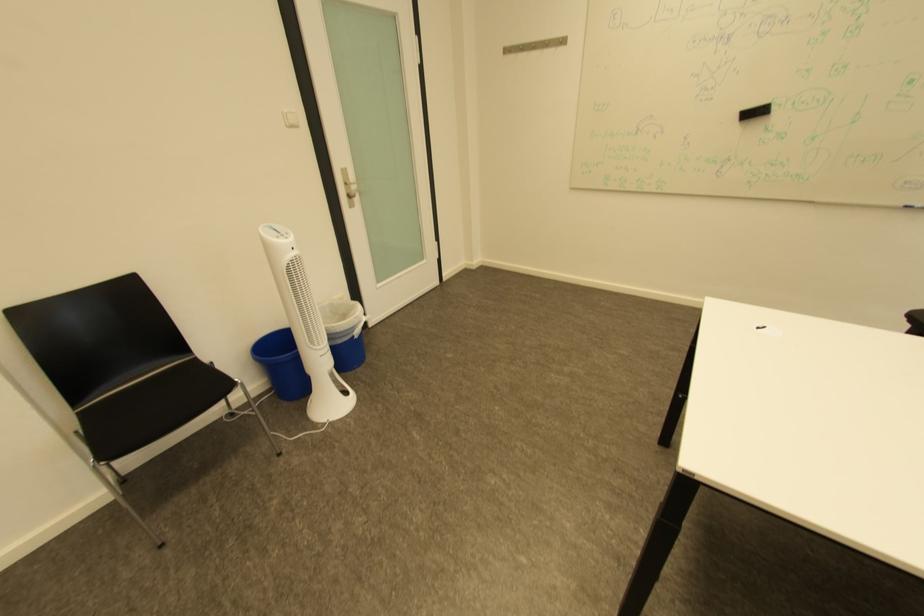
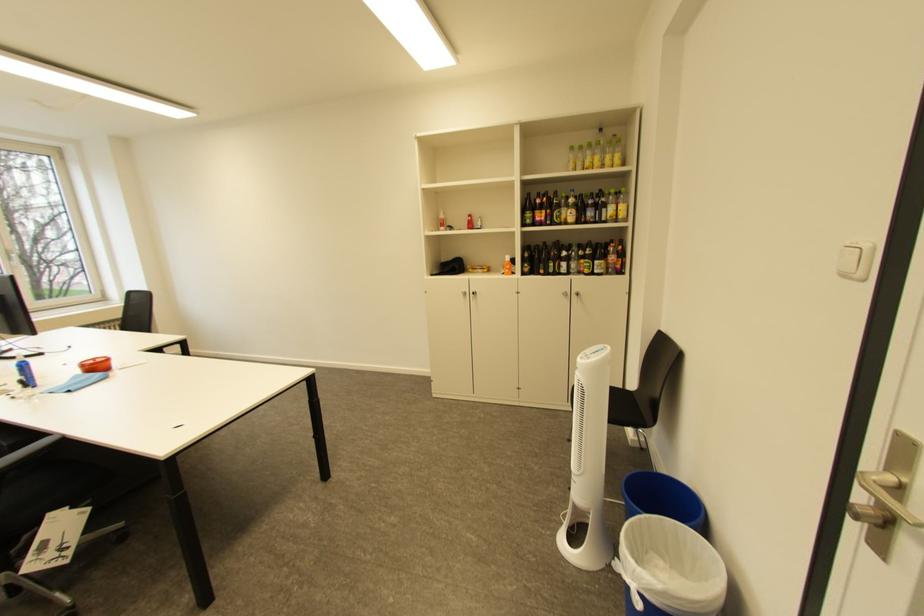
Find the pixel in the second image that matches [370,323] in the first image.

(636, 570)